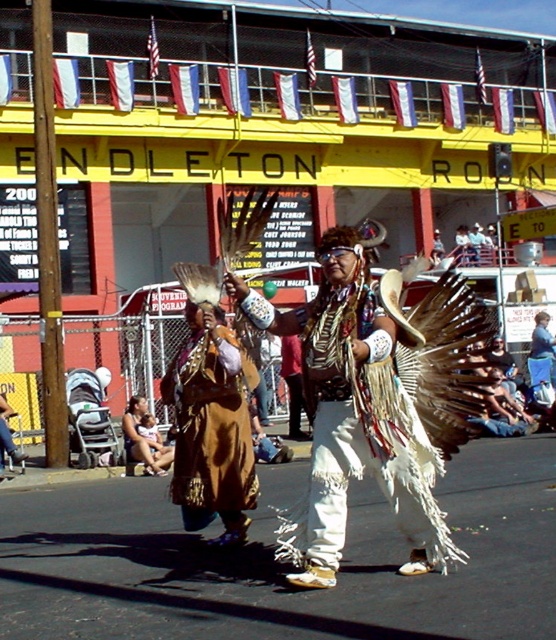
You are an artist trying to sketch the scene. You notice two central elements in the image. Which one is closer to you, the white fringed feathers at center or the brown feathered headdress at center?

The white fringed feathers at center is in front of the brown feathered headdress at center, so it is closer to you.

In the scene shown: You are a photographer at the event and want to capture both the white fringed feathers at center and the brown feathered headdress at center in a single shot. From which side should you position yourself to ensure both objects are visible without moving the subjects?

You should position yourself to the right side of the subjects so that both the white fringed feathers at center and the brown feathered headdress at center are visible. Since the white fringed feathers at center are to the left of the brown feathered headdress at center, positioning yourself to the right allows you to capture both in the frame without obstruction.

You are an event planner observing the scene and need to ensure that the brown suede dress at center and the brown feathered headdress at center can fit into a display case. The case has a height limit of 1 meter. Can both items fit vertically without overlapping?

The brown suede dress at center has a smaller size compared to the brown feathered headdress at center. Since the headdress is larger, it might exceed the 1 meter height limit. However, if the headdress can be tilted or arranged vertically within the case, both items could potentially fit without overlapping.